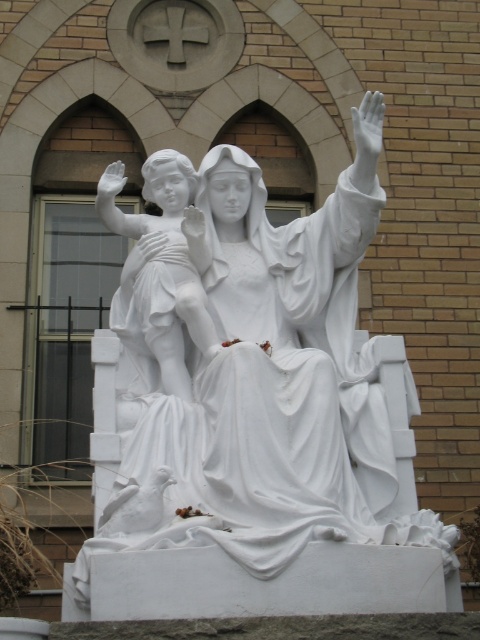
Which is behind, point (169, 500) or point (151, 289)?

Point (151, 289)

How distant is white marble statue at center from white marble cherub at center?

white marble statue at center and white marble cherub at center are 8.29 feet apart from each other.

Between point (408, 416) and point (156, 358), which one is positioned in front?

Positioned in front is point (408, 416).

This screenshot has height=640, width=480. Identify the location of white marble statue at center. (266, 394).

Which is below, white marble cherub at center or white marble hand at upper center?

Positioned lower is white marble cherub at center.

Does white marble cherub at center have a smaller size compared to white marble hand at upper center?

Correct, white marble cherub at center occupies less space than white marble hand at upper center.

What are the coordinates of `white marble cherub at center` in the screenshot? It's located at (165, 272).

Who is higher up, white marble statue at center or white marble hand at upper center?

white marble hand at upper center

Between white marble statue at center and white marble hand at upper center, which one has more height?

white marble statue at center is taller.

Find the location of a particular element. white marble statue at center is located at coordinates (266, 394).

I want to click on white marble statue at center, so click(x=266, y=394).